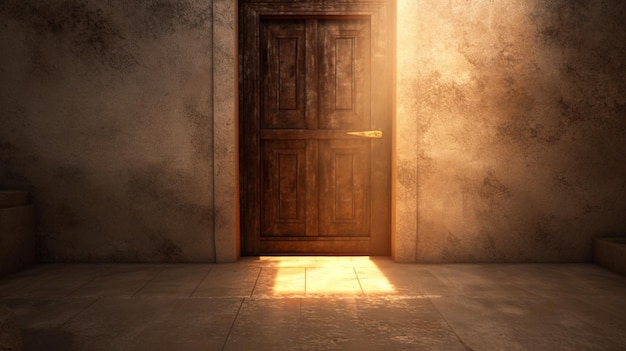
Find the location of a particular element. door frame is located at coordinates (225, 135), (401, 122).